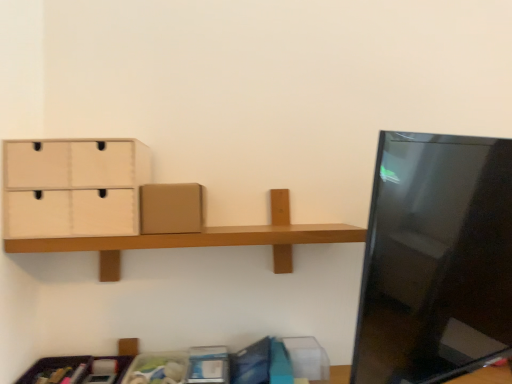
Question: In the image, is brown cardboard box at center on the left side or the right side of beige cardboard drawer at upper left?

Choices:
 (A) right
 (B) left

Answer: (A)

Question: Relative to beige cardboard drawer at upper left, is brown cardboard box at center in front or behind?

Choices:
 (A) front
 (B) behind

Answer: (B)

Question: In terms of width, does brown cardboard box at center look wider or thinner when compared to beige cardboard drawer at upper left?

Choices:
 (A) wide
 (B) thin

Answer: (A)

Question: From a real-world perspective, is beige cardboard drawer at upper left above or below brown cardboard box at center?

Choices:
 (A) above
 (B) below

Answer: (A)

Question: Considering the positions of point pos(39,190) and point pos(178,215), is point pos(39,190) closer or farther from the camera than point pos(178,215)?

Choices:
 (A) closer
 (B) farther

Answer: (A)

Question: Looking at the image, does beige cardboard drawer at upper left seem bigger or smaller compared to brown cardboard box at center?

Choices:
 (A) big
 (B) small

Answer: (A)

Question: Considering their positions, is beige cardboard drawer at upper left located in front of or behind brown cardboard box at center?

Choices:
 (A) behind
 (B) front

Answer: (B)